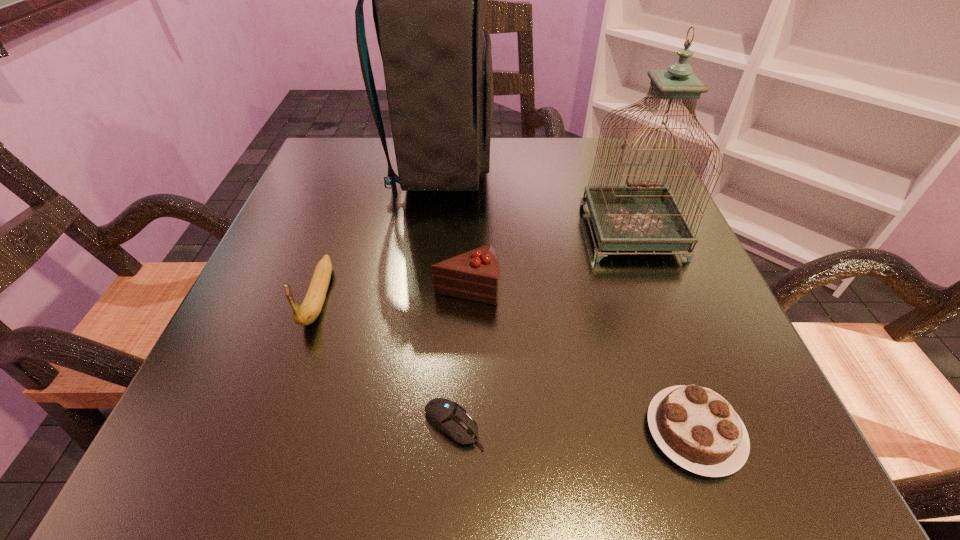
This screenshot has height=540, width=960. Find the location of `vacant area that lies between the shortest object and the banana`. vacant area that lies between the shortest object and the banana is located at coordinates (386, 362).

At what (x,y) coordinates should I click in order to perform the action: click on free space that is in between the tallest object and the left chocolate cake. Please return your answer as a coordinate pair (x, y). The height and width of the screenshot is (540, 960). Looking at the image, I should click on (453, 228).

This screenshot has height=540, width=960. What are the coordinates of `free space that is in between the shortest object and the right chocolate cake` in the screenshot? It's located at (574, 429).

You are a GUI agent. You are given a task and a screenshot of the screen. Output one action in this format:
    pyautogui.click(x=<x>, y=<y>)
    Task: Click on the vacant space that is in between the backpack and the birdcage
    The image size is (960, 540).
    Given the screenshot: What is the action you would take?
    pyautogui.click(x=536, y=200)

Locate an element on the screen. The height and width of the screenshot is (540, 960). empty space between the leftmost object and the computer mouse is located at coordinates (386, 362).

This screenshot has width=960, height=540. Identify the location of free spot between the taller chocolate cake and the second tallest object. (549, 260).

Point out which object is positioned as the second nearest to the shortest object. Please provide its 2D coordinates. Your answer should be formatted as a tuple, i.e. [(x, y)], where the tuple contains the x and y coordinates of a point satisfying the conditions above.

[(698, 429)]

Select which object appears as the second closest to the computer mouse. Please provide its 2D coordinates. Your answer should be formatted as a tuple, i.e. [(x, y)], where the tuple contains the x and y coordinates of a point satisfying the conditions above.

[(698, 429)]

Find the location of `vacant space that satisfies the following two spatial constraints: 1. at the stem of the fourth shortest object; 2. on the left side of the nearer chocolate cake`. vacant space that satisfies the following two spatial constraints: 1. at the stem of the fourth shortest object; 2. on the left side of the nearer chocolate cake is located at coordinates (272, 432).

Identify the location of free space in the image that satisfies the following two spatial constraints: 1. on the front-facing side of the tallest object; 2. on the back side of the taller chocolate cake. (426, 287).